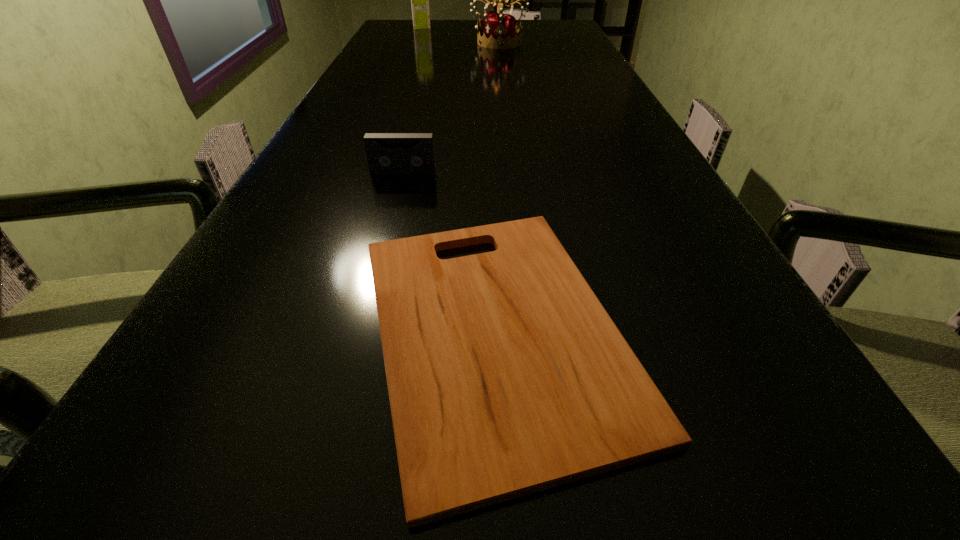
Locate an element on the screen. free area in between the soya milk and the third farthest object is located at coordinates pos(413,99).

Where is `blank region between the farthest object and the second shortest object`? The width and height of the screenshot is (960, 540). blank region between the farthest object and the second shortest object is located at coordinates (413, 99).

Where is `empty space between the soya milk and the tiara`? The height and width of the screenshot is (540, 960). empty space between the soya milk and the tiara is located at coordinates (460, 35).

Identify the location of vacant space that's between the tiara and the farthest object. (460, 35).

This screenshot has width=960, height=540. In order to click on free space between the shortest object and the soya milk in this screenshot , I will do `click(459, 178)`.

At what (x,y) coordinates should I click in order to perform the action: click on vacant space in between the soya milk and the tiara. Please return your answer as a coordinate pair (x, y). The height and width of the screenshot is (540, 960). Looking at the image, I should click on (460, 35).

This screenshot has width=960, height=540. I want to click on vacant point located between the shortest object and the farthest object, so click(459, 178).

The height and width of the screenshot is (540, 960). In order to click on vacant space in between the tiara and the farthest object in this screenshot , I will do `click(460, 35)`.

The width and height of the screenshot is (960, 540). I want to click on vacant area between the tiara and the third tallest object, so click(451, 107).

I want to click on empty location between the chopping board and the videotape, so click(449, 251).